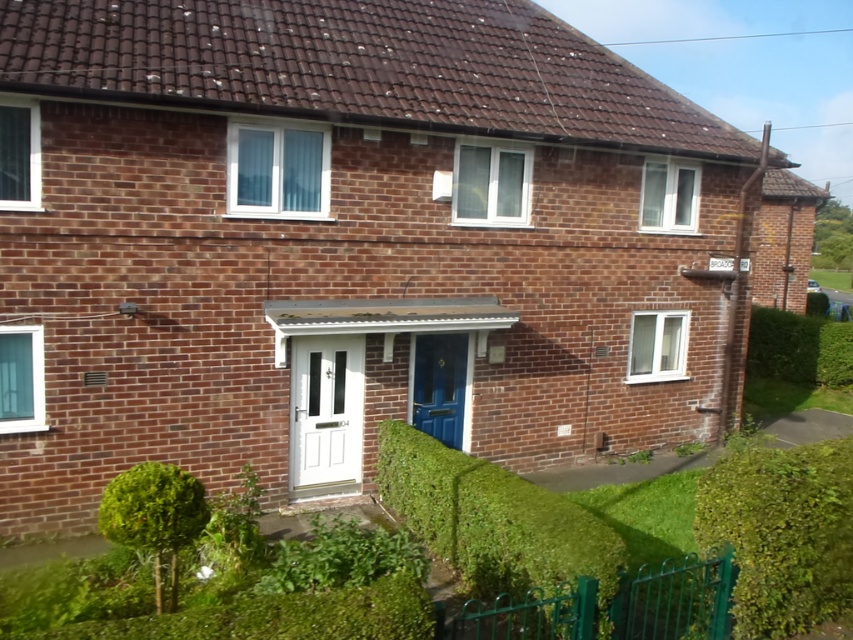
Between point (757, 573) and point (132, 540), which one is positioned in front?

Point (132, 540) is in front.

Is point (834, 531) more distant than point (196, 486)?

No, it is not.

Identify the location of green leafy hedge at lower right. (781, 532).

Does green leafy hedge at lower center have a greater width compared to green leafy hedge at right?

No.

Is point (395, 422) positioned after point (813, 349)?

No, (395, 422) is in front of (813, 349).

Find the location of `green leafy hedge at lower center`. green leafy hedge at lower center is located at coordinates (492, 520).

Is green leafy hedge at lower center further to the viewer compared to green leafy hedge at lower right?

No, green leafy hedge at lower center is in front of green leafy hedge at lower right.

Which is in front, point (548, 560) or point (817, 490)?

Point (548, 560)

What are the coordinates of `green leafy hedge at lower center` in the screenshot? It's located at (492, 520).